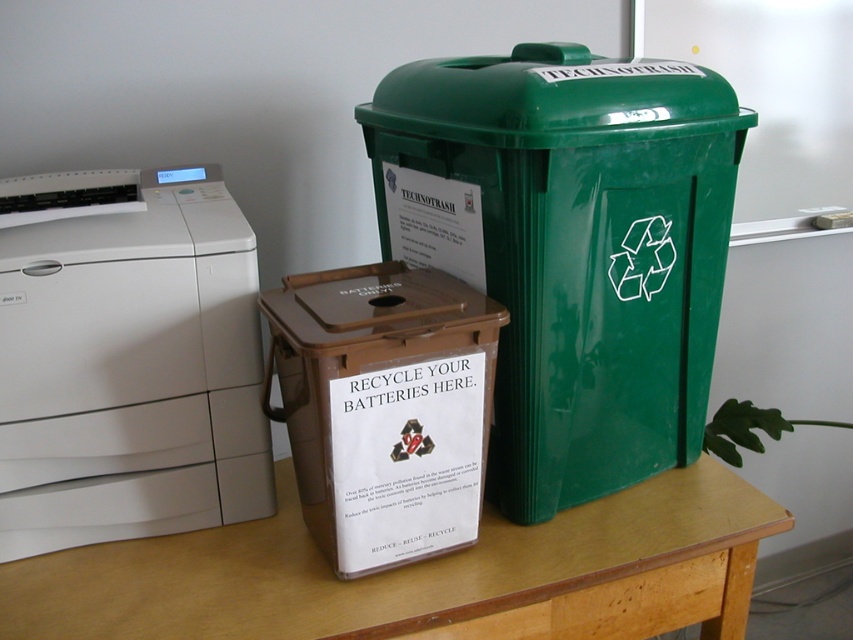
Looking at this image, you are organizing a community recycling event and need to place a large electronic device into one of the bins. Which bin should you choose between the green glossy plastic recycling bin at upper right and the brown plastic box at center?

The green glossy plastic recycling bin at upper right is bigger than the brown plastic box at center, so you should choose the green glossy plastic recycling bin at upper right to place the large electronic device.

You have a small electronic device that needs to be recycled and you are standing 2 feet away from the table. The green glossy plastic recycling bin at upper right is for technotrash, while the brown plastic box at center is for batteries. Which bin should you use, and will you be able to reach it from your current position?

You should use the green glossy plastic recycling bin at upper right for the electronic device. Since you are 2 feet away from the table, you can easily reach it as the distance between you and the table is sufficient to place the device into the bin.

From the picture: You need to place a new white plastic printer at left and a brown plastic box at center on a table. The table can only hold items that are smaller than the printer. Can both items fit on the table?

The white plastic printer at left has a larger size compared to brown plastic box at center. Since the table can only hold items smaller than the printer, the brown plastic box at center can fit, but the white plastic printer at left cannot. Therefore, only the brown plastic box at center can be placed on the table.